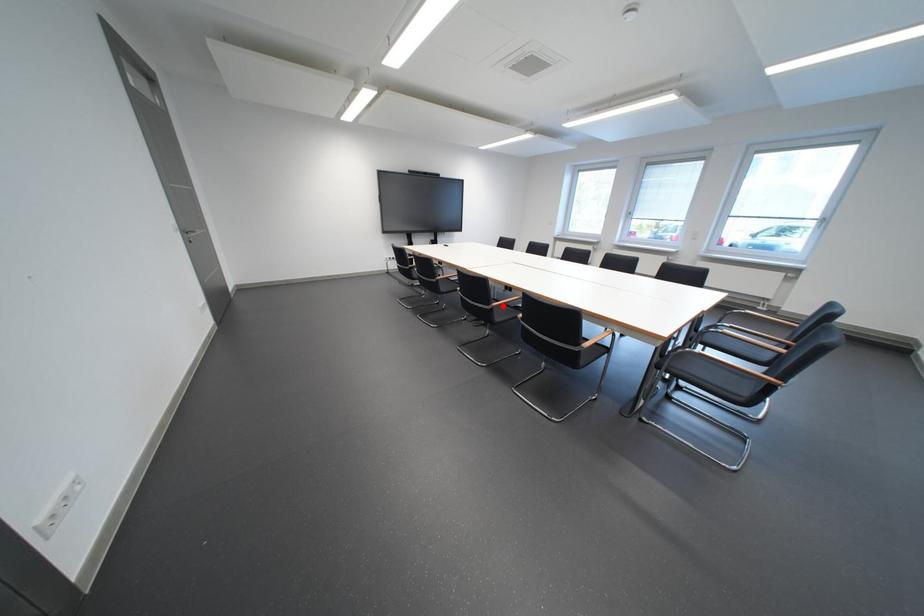
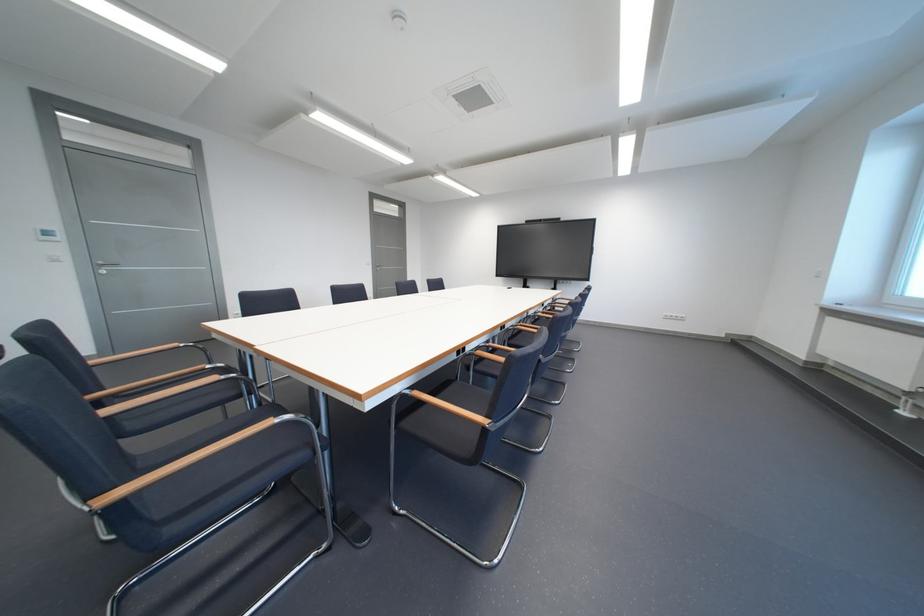
Question: I am providing you with two images of the same scene from different viewpoints. A red point is marked on the first image. Is the red point's position out of view in image 2?

Choices:
 (A) Yes
 (B) No

Answer: (A)